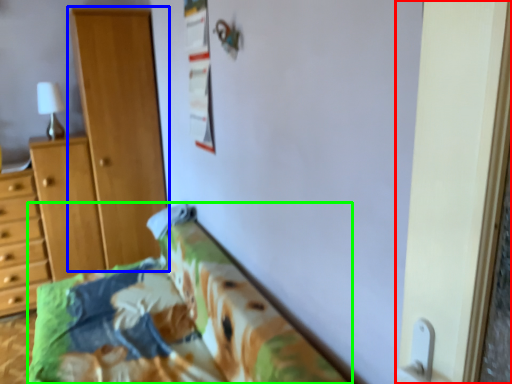
Question: Which is nearer to the screen door (highlighted by a red box)? cupboard (highlighted by a blue box) or furniture (highlighted by a green box).

Choices:
 (A) cupboard
 (B) furniture

Answer: (B)